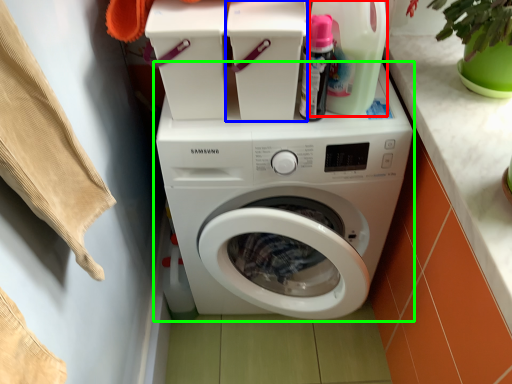
Question: Which object is positioned farthest from cleaning product (highlighted by a red box)? Select from appliance (highlighted by a blue box) and washing machine (highlighted by a green box).

Choices:
 (A) appliance
 (B) washing machine

Answer: (B)